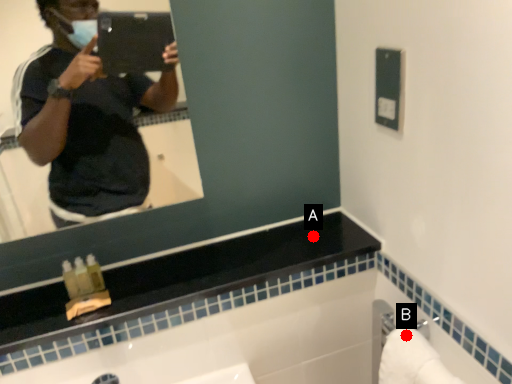
Question: Two points are circled on the image, labeled by A and B beside each circle. Which point is further to the camera?

Choices:
 (A) A is further
 (B) B is further

Answer: (A)